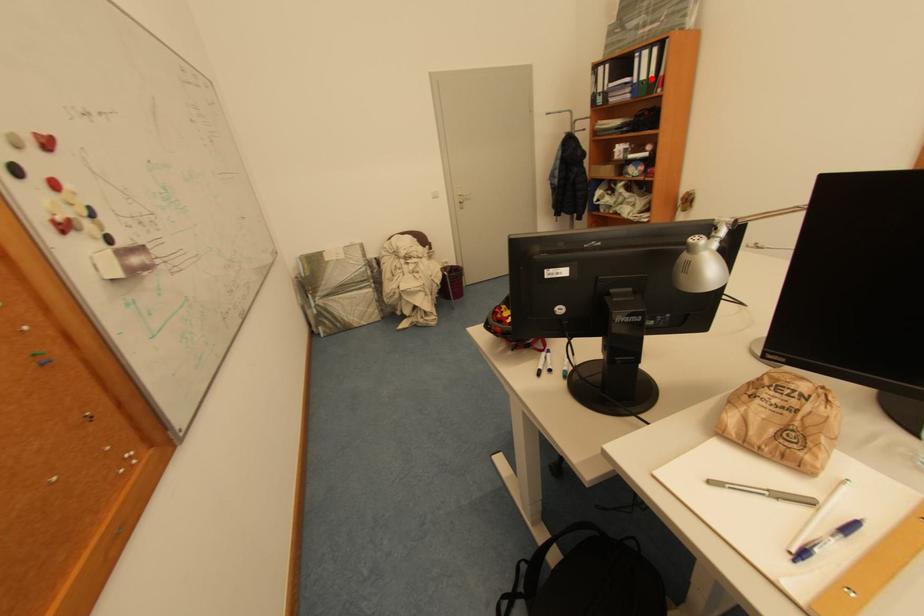
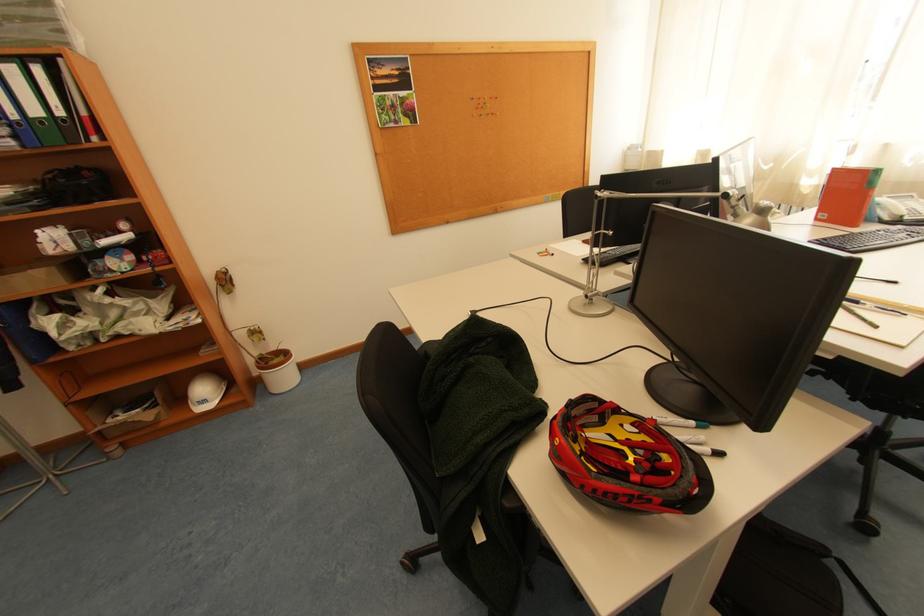
Question: A red point is marked in image1. In image2, is the corresponding 3D point closer to the camera or farther? Reply with the corresponding letter.

Choices:
 (A) The corresponding 3D point is closer.
 (B) The corresponding 3D point is farther.

Answer: (B)